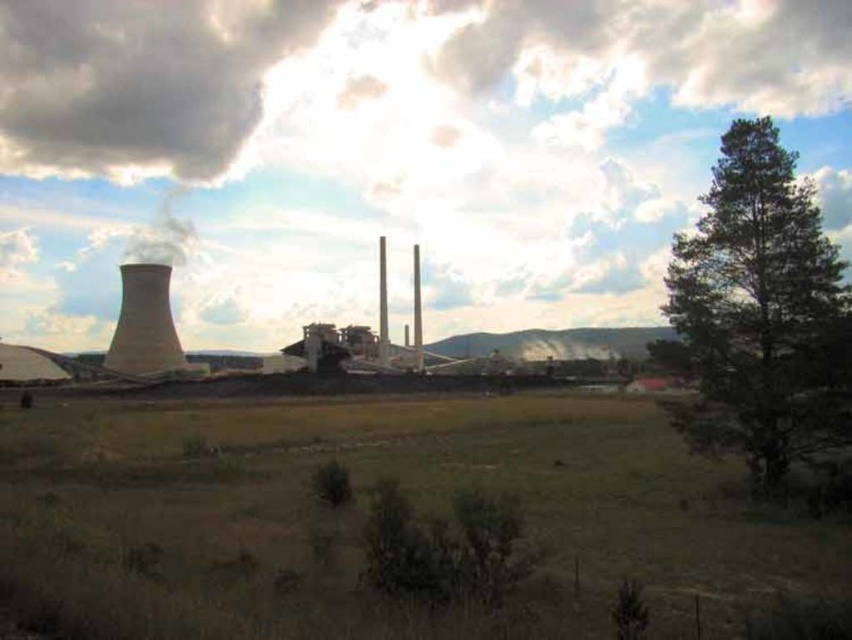
Question: Is green leafy tree at right to the right of smooth concrete chimney at left from the viewer's perspective?

Choices:
 (A) no
 (B) yes

Answer: (B)

Question: Is green grass at center to the left of smooth concrete chimney at left from the viewer's perspective?

Choices:
 (A) yes
 (B) no

Answer: (B)

Question: Does green grass at center come behind smooth concrete chimney at left?

Choices:
 (A) no
 (B) yes

Answer: (A)

Question: Which object is farther from the camera taking this photo?

Choices:
 (A) dark gray cloud at upper left
 (B) green leafy tree at right
 (C) white fluffy cloud at upper center
 (D) smooth concrete chimney at left

Answer: (A)

Question: Which of the following is the closest to the observer?

Choices:
 (A) (257, 230)
 (B) (756, 276)
 (C) (147, 504)
 (D) (171, 144)

Answer: (C)

Question: Estimate the real-world distances between objects in this image. Which object is closer to the green leafy tree at right?

Choices:
 (A) dark gray cloud at upper left
 (B) white fluffy cloud at upper center
 (C) green grass at center

Answer: (C)